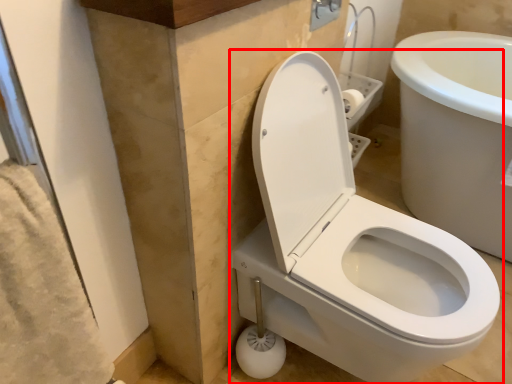
Question: From the image's perspective, where is toilet (annotated by the red box) located relative to shower?

Choices:
 (A) below
 (B) above

Answer: (B)